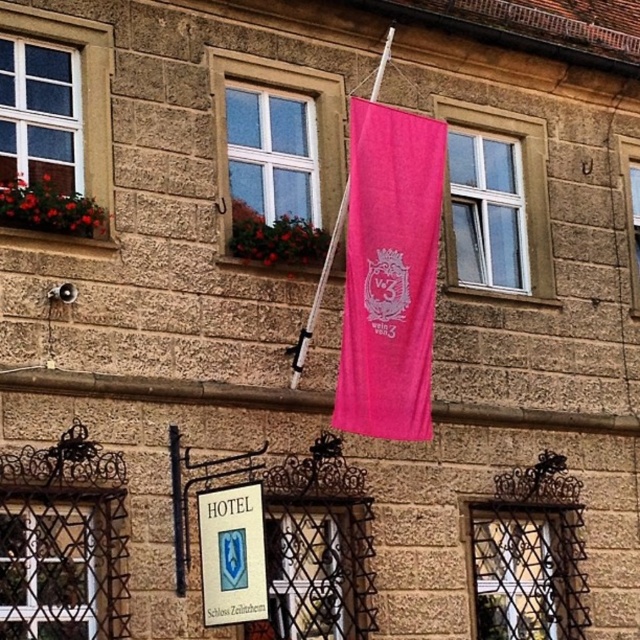
You are standing in front of the building and want to hang a new decorative banner. The banner is slightly larger than the pink fabric flag at upper center. Where should you place the banner so it doesn not cover the metallic wire mesh at center?

You should place the banner in a position that does not overlap with the metallic wire mesh at center. Since the pink fabric flag at upper center is already positioned over the metallic wire mesh at center, placing the banner elsewhere, such as to the side or lower down, would prevent it from covering the mesh.

You are a painter who needs to reach both the pink fabric flag at upper center and the metallic wire mesh at center while standing on a ladder. The ladder can extend up to 3.5 meters. Can you safely reach both objects without moving the ladder?

The distance between the pink fabric flag at upper center and the metallic wire mesh at center is 3.60 meters. Since the ladder can only extend up to 3.5 meters, you cannot safely reach both objects without moving the ladder because the distance exceeds the ladder length.

You are a delivery person trying to locate the entrance to the hotel. The entrance is at the bottom of the building. According to the image, where is the metallic wire mesh at center located relative to the entrance?

The metallic wire mesh at center is located at point (317, 570), which is near the center of the building facade. Since the entrance is at the bottom, the metallic wire mesh at center is above the entrance.